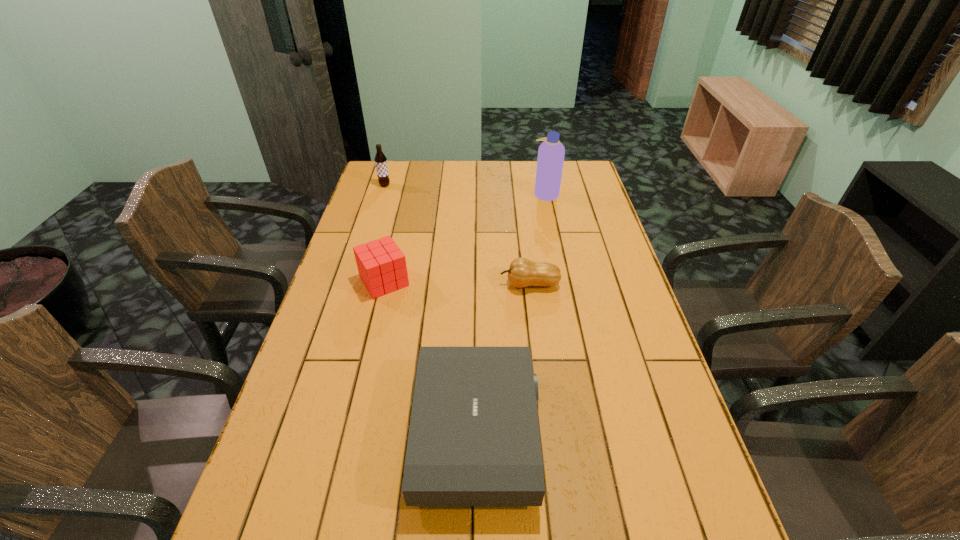
The image size is (960, 540). I want to click on the tallest object, so click(x=551, y=152).

The width and height of the screenshot is (960, 540). I want to click on the second tallest object, so click(x=380, y=159).

Find the location of a particular element. The height and width of the screenshot is (540, 960). cube is located at coordinates (381, 264).

Where is `projector`? The image size is (960, 540). projector is located at coordinates (474, 440).

Locate an element on the screen. Image resolution: width=960 pixels, height=540 pixels. gourd is located at coordinates (522, 272).

The width and height of the screenshot is (960, 540). Find the location of `vacant space situated 0.160m on the back of the shampoo`. vacant space situated 0.160m on the back of the shampoo is located at coordinates pos(540,167).

The width and height of the screenshot is (960, 540). I want to click on free space located on the right of the root beer, so click(411, 185).

The image size is (960, 540). In order to click on vacant space located on the right of the cube in this screenshot , I will do `click(485, 281)`.

Locate an element on the screen. The width and height of the screenshot is (960, 540). free space located 0.190m on the front-facing side of the nearest object is located at coordinates (622, 433).

Locate an element on the screen. vacant point located on the stem side of the shortest object is located at coordinates (458, 284).